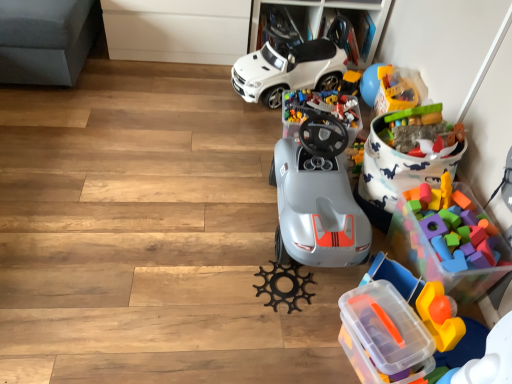
Question: Is black matte gear at center, the 2th toy in the bottom-to-top sequence, wider than rubberized plastic toy at upper right, the 4th toy positioned from the bottom?

Choices:
 (A) no
 (B) yes

Answer: (B)

Question: Is black matte gear at center, acting as the 5th toy starting from the top, facing away from rubberized plastic toy at upper right, marked as the 3th toy in a top-to-bottom arrangement?

Choices:
 (A) yes
 (B) no

Answer: (B)

Question: Considering the relative positions of black matte gear at center, acting as the 5th toy starting from the top, and rubberized plastic toy at upper right, the 4th toy positioned from the bottom, in the image provided, is black matte gear at center, acting as the 5th toy starting from the top, to the left of rubberized plastic toy at upper right, the 4th toy positioned from the bottom, from the viewer's perspective?

Choices:
 (A) yes
 (B) no

Answer: (A)

Question: From a real-world perspective, is black matte gear at center, the 2th toy in the bottom-to-top sequence, located beneath rubberized plastic toy at upper right, marked as the 3th toy in a top-to-bottom arrangement?

Choices:
 (A) no
 (B) yes

Answer: (B)

Question: Is black matte gear at center, acting as the 5th toy starting from the top, smaller than rubberized plastic toy at upper right, marked as the 3th toy in a top-to-bottom arrangement?

Choices:
 (A) yes
 (B) no

Answer: (A)

Question: From a real-world perspective, is rubberized plastic toy at upper right, positioned as the first toy in top-to-bottom order, physically located above or below rubberized plastic toy at upper right, the 4th toy positioned from the bottom?

Choices:
 (A) below
 (B) above

Answer: (A)

Question: Considering the positions of point (391, 107) and point (446, 148), is point (391, 107) closer or farther from the camera than point (446, 148)?

Choices:
 (A) farther
 (B) closer

Answer: (A)

Question: Is rubberized plastic toy at upper right, the 6th toy positioned from the bottom, taller or shorter than rubberized plastic toy at upper right, the 4th toy positioned from the bottom?

Choices:
 (A) tall
 (B) short

Answer: (A)

Question: Looking at the image, does rubberized plastic toy at upper right, positioned as the first toy in top-to-bottom order, seem bigger or smaller compared to rubberized plastic toy at upper right, marked as the 3th toy in a top-to-bottom arrangement?

Choices:
 (A) big
 (B) small

Answer: (A)

Question: From the image's perspective, is translucent plastic storage box at lower right above or below rubberized plastic toy at upper right, positioned as the first toy in top-to-bottom order?

Choices:
 (A) below
 (B) above

Answer: (A)

Question: In terms of size, does translucent plastic storage box at lower right appear bigger or smaller than rubberized plastic toy at upper right, positioned as the first toy in top-to-bottom order?

Choices:
 (A) big
 (B) small

Answer: (A)

Question: From a real-world perspective, is translucent plastic storage box at lower right positioned above or below rubberized plastic toy at upper right, positioned as the first toy in top-to-bottom order?

Choices:
 (A) above
 (B) below

Answer: (B)

Question: Relative to rubberized plastic toy at upper right, positioned as the first toy in top-to-bottom order, is translucent plastic storage box at lower right in front or behind?

Choices:
 (A) front
 (B) behind

Answer: (A)

Question: From a real-world perspective, is rubberized plastic toy at upper right, the 4th toy positioned from the bottom, physically located above or below translucent plastic blocks at lower right, the 1th toy when ordered from bottom to top?

Choices:
 (A) above
 (B) below

Answer: (A)

Question: From the image's perspective, relative to translucent plastic blocks at lower right, the sixth toy positioned from the top, is rubberized plastic toy at upper right, the 4th toy positioned from the bottom, above or below?

Choices:
 (A) below
 (B) above

Answer: (B)